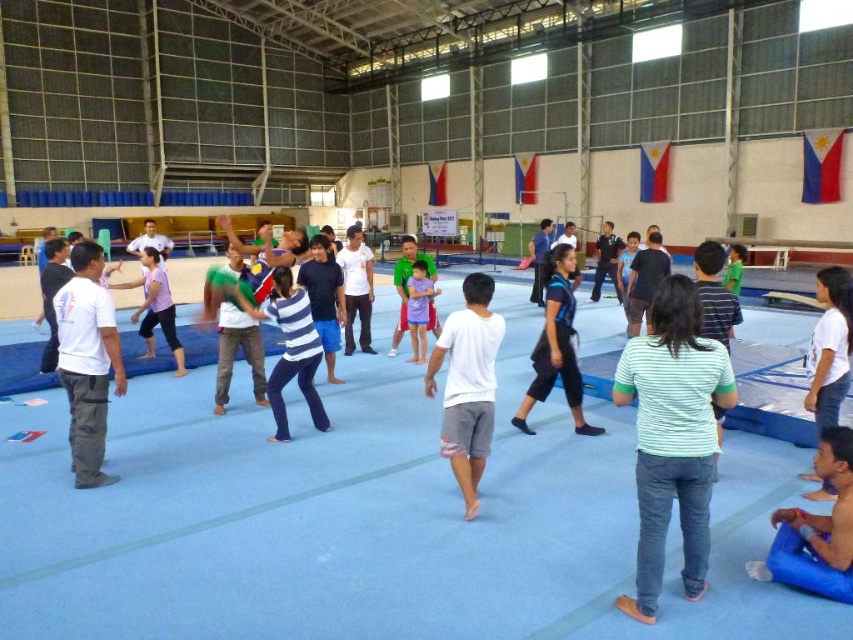
You are standing at the entrance of the gymnasium and want to locate the green striped shirt at center. Based on the coordinates provided, in which direction should you look to find it?

The green striped shirt at center is located at coordinates point (672, 436), so you should look towards the lower right direction from your current position at the entrance.

Consider the image. You are standing in the gymnasium and want to determine which of the two points, point (76,396) or point (419,273), is nearer to you. Based on the coordinates provided, which point is closer?

Point (76,396) is closer to the camera than point (419,273), so it is the nearer point.

You are a photographer positioned at the entrance of the gym. You need to capture a photo where the green striped shirt at center and blue matte shorts at center are clearly visible. Based on their positions, which clothing item should you focus on first to ensure both are in frame?

The green striped shirt at center is below blue matte shorts at center, so you should focus on the blue matte shorts at center first as it is higher up, ensuring both will be in frame when centered.